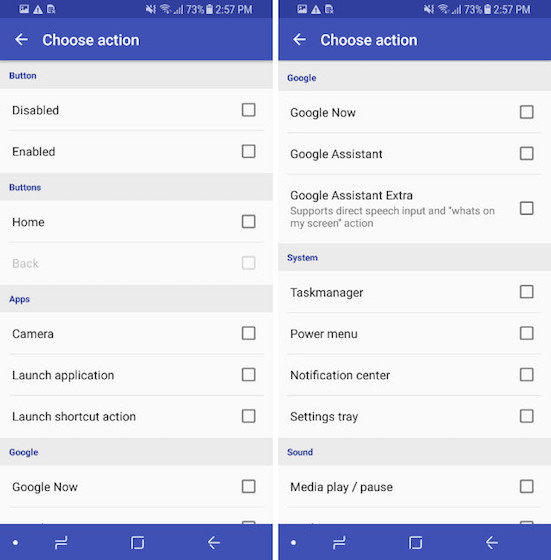
Image resolution: width=551 pixels, height=560 pixels. What are the coordinates of `sound box` in the screenshot? It's located at (307, 447).